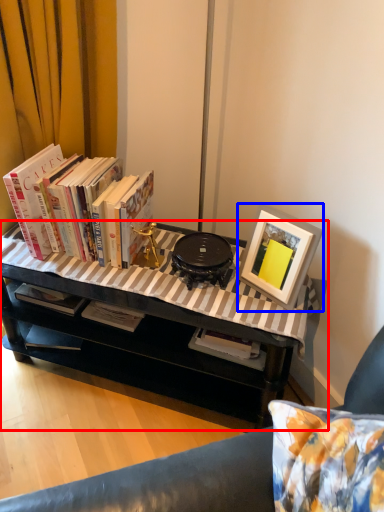
Question: Which point is further to the camera, table (highlighted by a red box) or picture frame (highlighted by a blue box)?

Choices:
 (A) table
 (B) picture frame

Answer: (B)